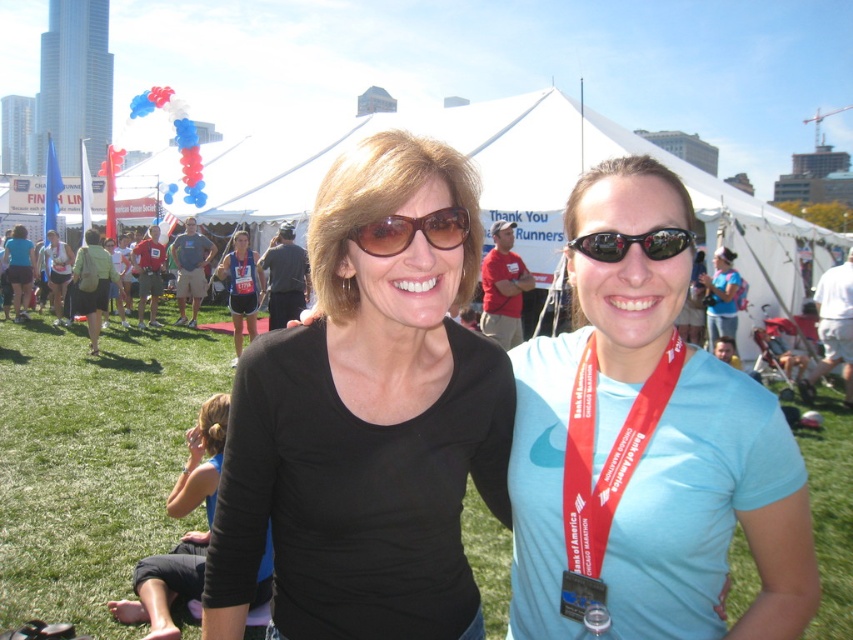
You are standing at the registration tent and need to direct a runner to the first aid station located at the point with coordinates point (x=229, y=253). However, there is an obstacle at point (x=48, y=253). Which point should the runner avoid to reach the first aid station safely?

The runner should avoid the obstacle at point (x=48, y=253) and proceed towards point (x=229, y=253) since it is the correct location of the first aid station and the obstacle is behind it.

You are a photographer at the event and need to ensure that both the matte blue tank top at center and the matte black tank top at center are visible in your photo. Given that your camera has a fixed focus that can only capture objects within a 30 cm width, will both tops fit within the frame?

The matte blue tank top at center is narrower than the matte black tank top at center. Since the camera can capture up to 30 cm, and the wider matte black tank top at center is within this limit, both tops will fit within the frame.

Looking at this image, you are a photographer trying to capture both the black matte shirt at center and the light blue fabric shirt at center in the same frame. Based on their positions, which shirt should you focus on first to ensure both are in the frame?

Since the black matte shirt at center might be wider than the light blue fabric shirt at center, you should focus on the black matte shirt at center first to accommodate its width and ensure both shirts are in the frame.